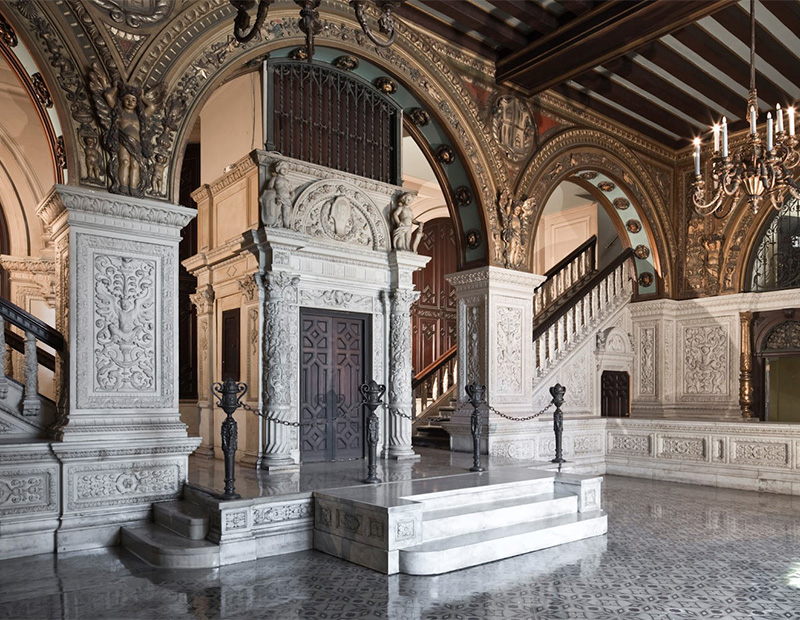
The height and width of the screenshot is (620, 800). I want to click on marble stairs, so click(181, 520), click(506, 511).